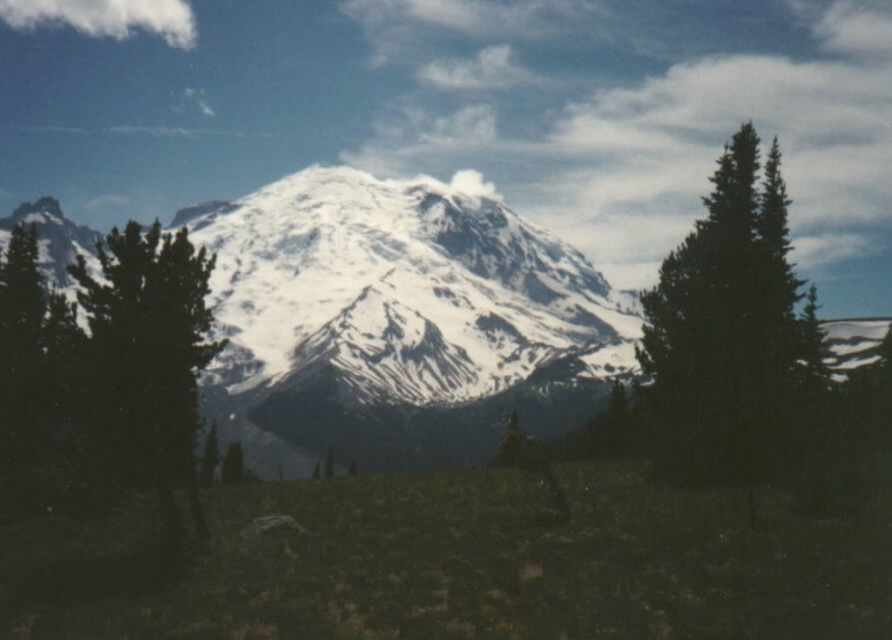
Between green matte tree at left and green textured pine tree at right, which one appears on the left side from the viewer's perspective?

From the viewer's perspective, green matte tree at left appears more on the left side.

Which is in front, point (73, 385) or point (651, 429)?

Point (73, 385)

You are a GUI agent. You are given a task and a screenshot of the screen. Output one action in this format:
    pyautogui.click(x=<x>, y=<y>)
    Task: Click on the green matte tree at left
    
    Given the screenshot: What is the action you would take?
    pyautogui.click(x=109, y=358)

You are a GUI agent. You are given a task and a screenshot of the screen. Output one action in this format:
    pyautogui.click(x=<x>, y=<y>)
    Task: Click on the white snow-covered mountain at center
    
    Given the screenshot: What is the action you would take?
    pyautogui.click(x=398, y=323)

Between white snow-covered mountain at center and green textured pine tree at right, which one appears on the right side from the viewer's perspective?

green textured pine tree at right

Is point (350, 266) positioned in front of point (671, 266)?

That is False.

The image size is (892, 640). What are the coordinates of `white snow-covered mountain at center` in the screenshot? It's located at (398, 323).

Can you confirm if white snow-covered mountain at center is positioned to the left of green matte tree at left?

Incorrect, white snow-covered mountain at center is not on the left side of green matte tree at left.

Is white snow-covered mountain at center to the right of green matte tree at left from the viewer's perspective?

Yes, white snow-covered mountain at center is to the right of green matte tree at left.

Between point (219, 301) and point (80, 304), which one is positioned in front?

Point (80, 304) is more forward.

Locate an element on the screen. white snow-covered mountain at center is located at coordinates (398, 323).